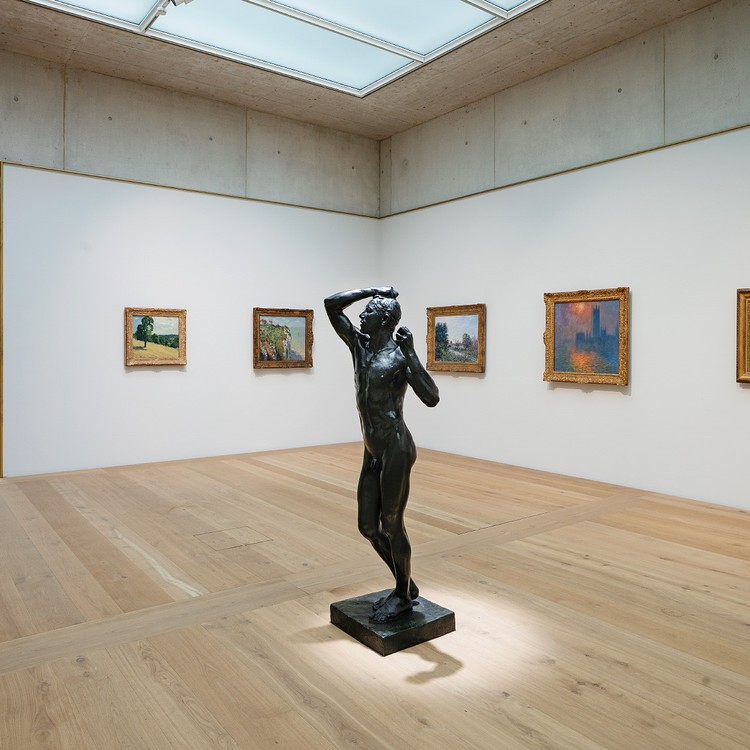
This screenshot has width=750, height=750. I want to click on black statue platform, so click(361, 616).